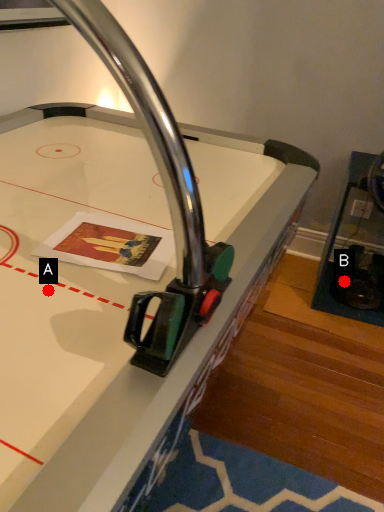
Question: Two points are circled on the image, labeled by A and B beside each circle. Among these points, which one is farthest from the camera?

Choices:
 (A) A is further
 (B) B is further

Answer: (B)